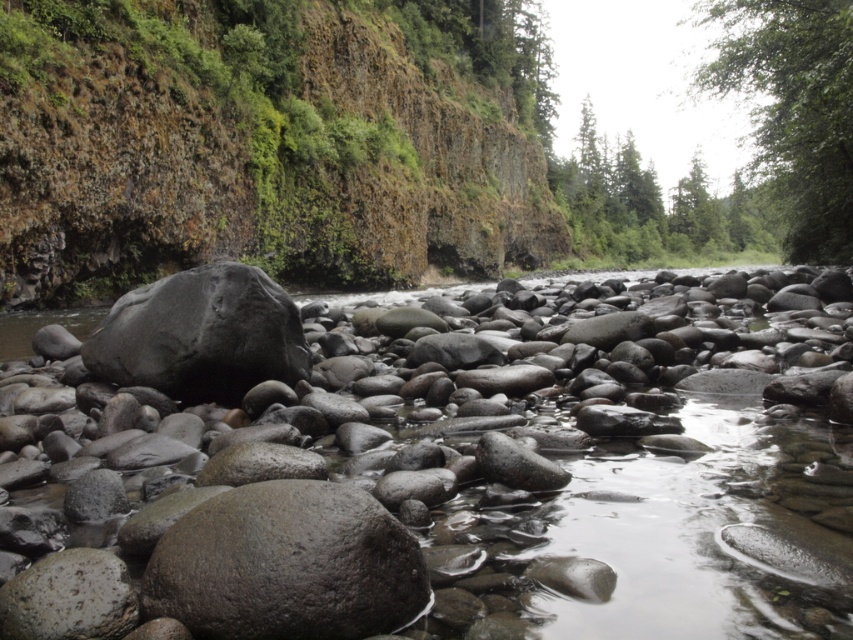
Based on the photo, who is more forward, (497, 138) or (802, 49)?

Point (802, 49) is more forward.

Describe the element at coordinates (250, 150) in the screenshot. I see `green mossy rock at left` at that location.

Where is `green mossy rock at left`? Image resolution: width=853 pixels, height=640 pixels. green mossy rock at left is located at coordinates (250, 150).

Which is behind, point (67, 113) or point (595, 163)?

Positioned behind is point (595, 163).

Is green mossy rock at left to the right of green matte tree at upper center from the viewer's perspective?

No, green mossy rock at left is not to the right of green matte tree at upper center.

Is point (488, 104) behind point (746, 236)?

No, it is not.

Where is `green mossy rock at left`? Image resolution: width=853 pixels, height=640 pixels. green mossy rock at left is located at coordinates (250, 150).

Between green leafy tree at upper right and green matte tree at upper center, which one is positioned lower?

green matte tree at upper center is lower down.

You are a GUI agent. You are given a task and a screenshot of the screen. Output one action in this format:
    pyautogui.click(x=<x>, y=<y>)
    Task: Click on the green leafy tree at upper right
    The image size is (853, 640).
    Given the screenshot: What is the action you would take?
    pyautogui.click(x=793, y=112)

The image size is (853, 640). Find the location of `green leafy tree at upper right`. green leafy tree at upper right is located at coordinates (793, 112).

Where is `green leafy tree at upper right`? The width and height of the screenshot is (853, 640). green leafy tree at upper right is located at coordinates (793, 112).